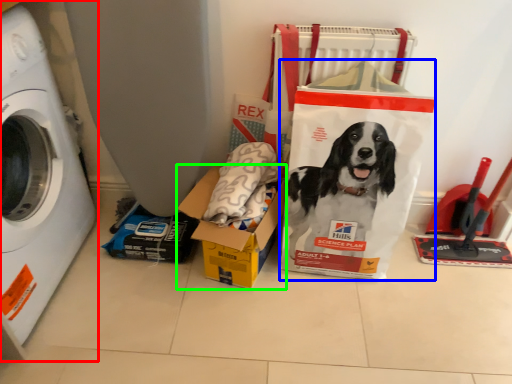
Question: Which object is the closest to the washing machine (highlighted by a red box)? Choose among these: paper bag (highlighted by a blue box) or box (highlighted by a green box).

Choices:
 (A) paper bag
 (B) box

Answer: (B)